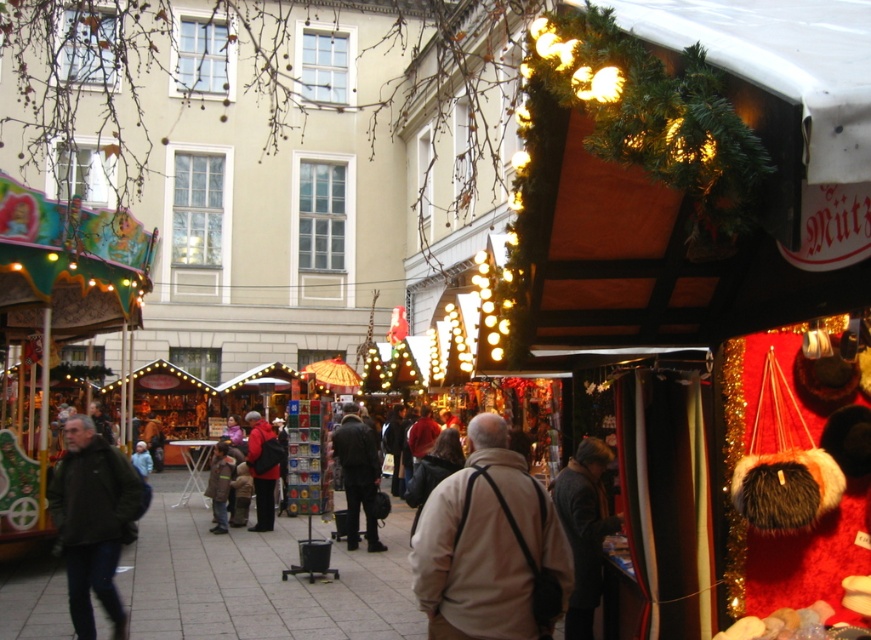
You are a customer at the Christmas market and want to try on both the beige fabric jacket at center and the dark gray leather jacket at center. Which jacket should you approach first to reach the one closer to you?

You should approach the beige fabric jacket at center first because it is closer to you than the dark gray leather jacket at center.

You are a vendor at the Christmas market and need to hang a decorative banner between the dark gray leather jacket at center and the red fabric jacket at center. Since the banner requires a certain amount of space, can you confirm if the combined width of both jackets will allow enough space for the banner to be displayed properly?

The dark gray leather jacket at center has a larger width than the red fabric jacket at center. However, the combined width of both jackets may still provide sufficient space for the banner, but this depends on the exact dimensions of the banner. Since the banner requires a certain amount of space, you should measure the total width of both jackets and compare it to the banner length to ensure proper display.